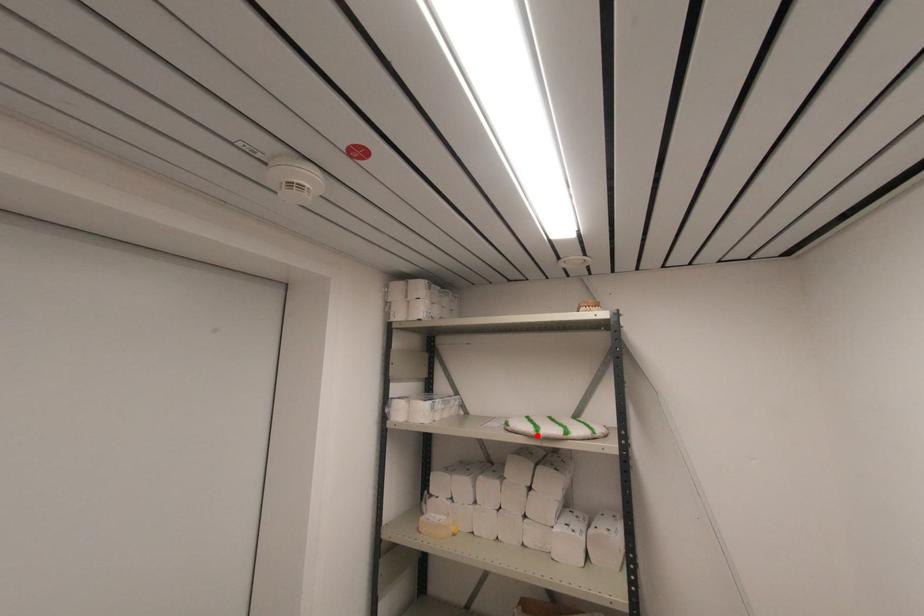
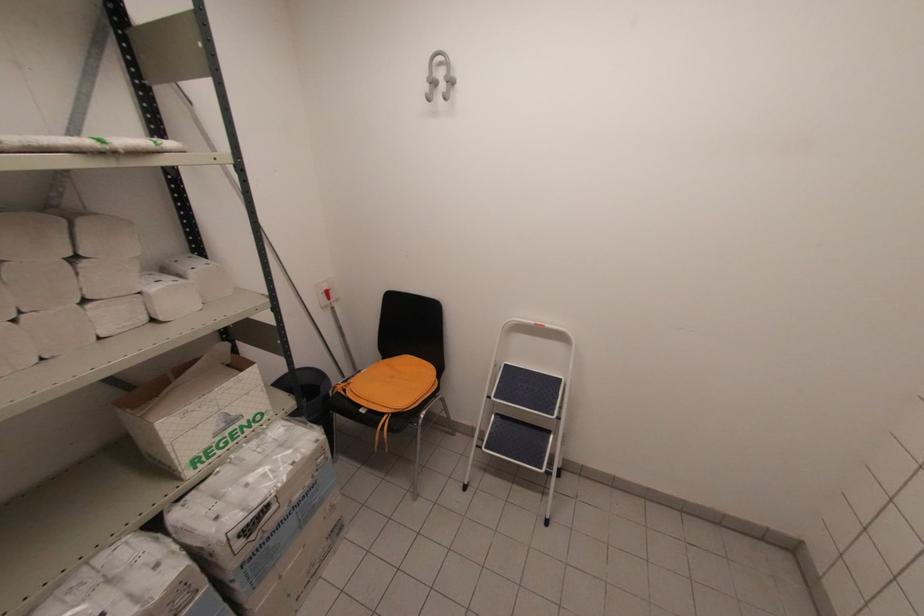
Find the pixel in the second image that matches the highlighted location in the first image.

(107, 148)